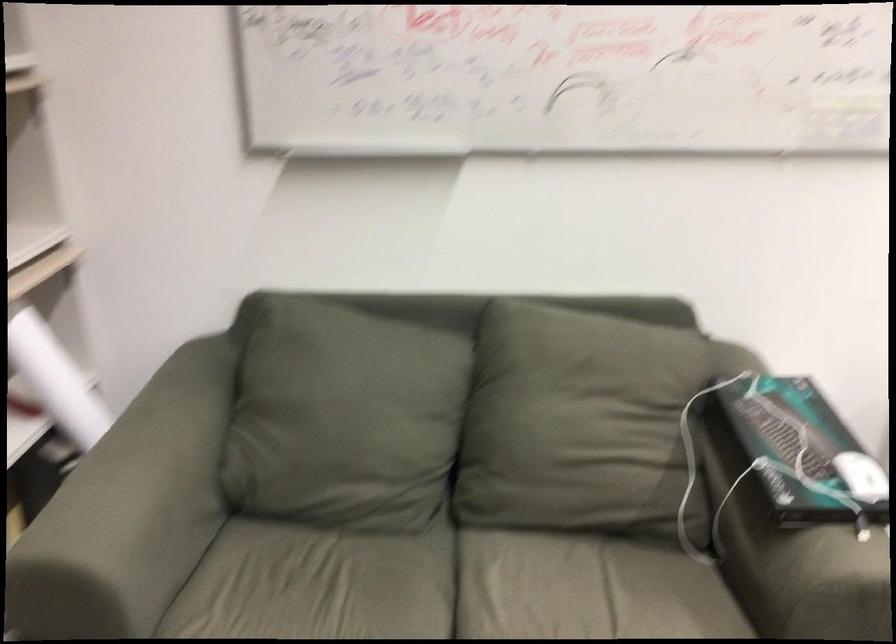
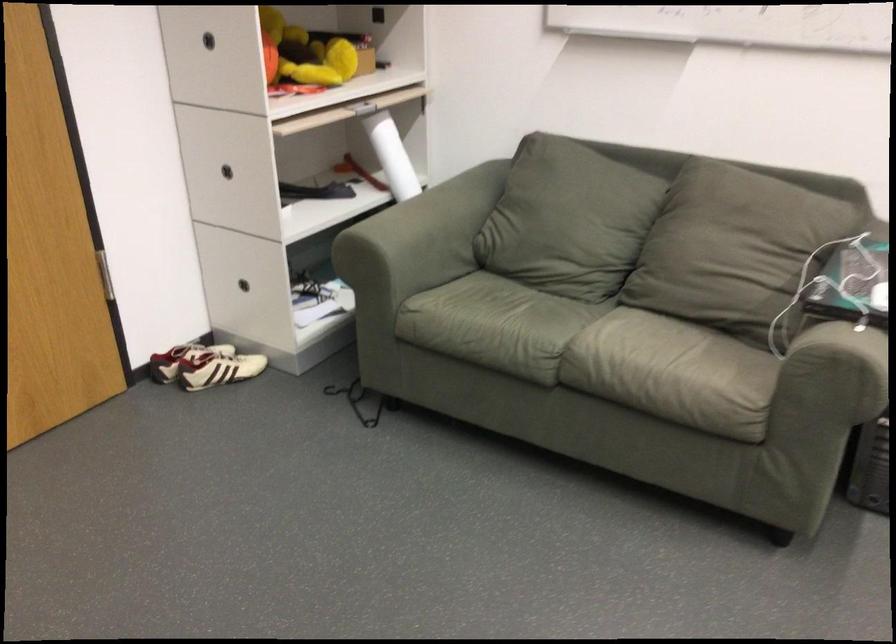
Locate, in the second image, the point that corresponds to the point at 156,524 in the first image.

(416, 242)